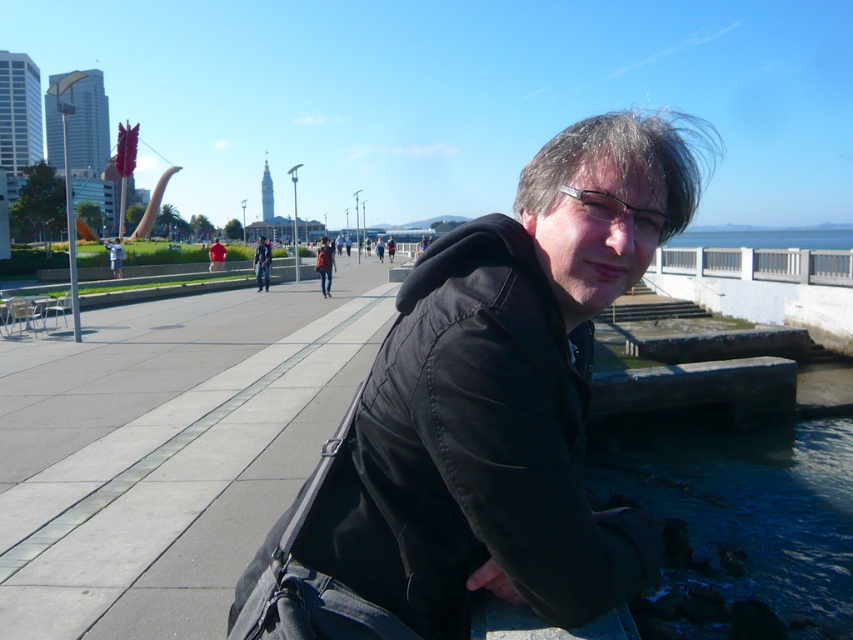
Can you confirm if black matte jacket at center is positioned to the left of denim jeans at center?

In fact, black matte jacket at center is to the right of denim jeans at center.

Which is behind, point (492, 328) or point (268, 250)?

The point (268, 250) is behind.

Is point (314, 564) farther from viewer compared to point (257, 262)?

No.

Where is `black matte jacket at center`? This screenshot has width=853, height=640. black matte jacket at center is located at coordinates (474, 451).

The width and height of the screenshot is (853, 640). Describe the element at coordinates (262, 262) in the screenshot. I see `denim jeans at center` at that location.

I want to click on denim jeans at center, so click(262, 262).

Find the location of a particular element. denim jeans at center is located at coordinates (262, 262).

Can you confirm if denim jeans at center is positioned to the left of red fabric shirt at center?

Incorrect, denim jeans at center is not on the left side of red fabric shirt at center.

Who is lower down, denim jeans at center or red fabric shirt at center?

denim jeans at center is below.

Which is in front, point (265, 256) or point (219, 250)?

Point (265, 256) is more forward.

This screenshot has height=640, width=853. I want to click on denim jeans at center, so click(x=262, y=262).